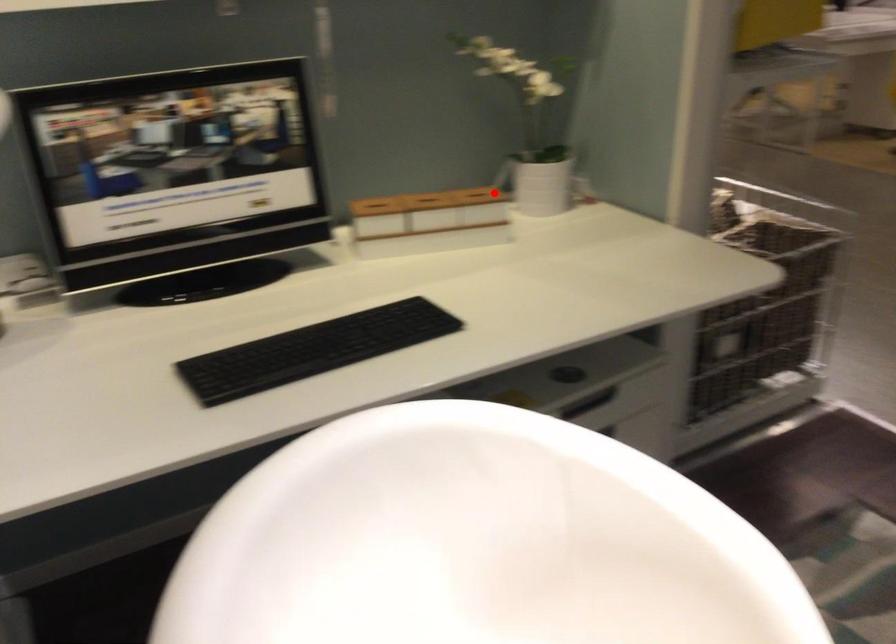
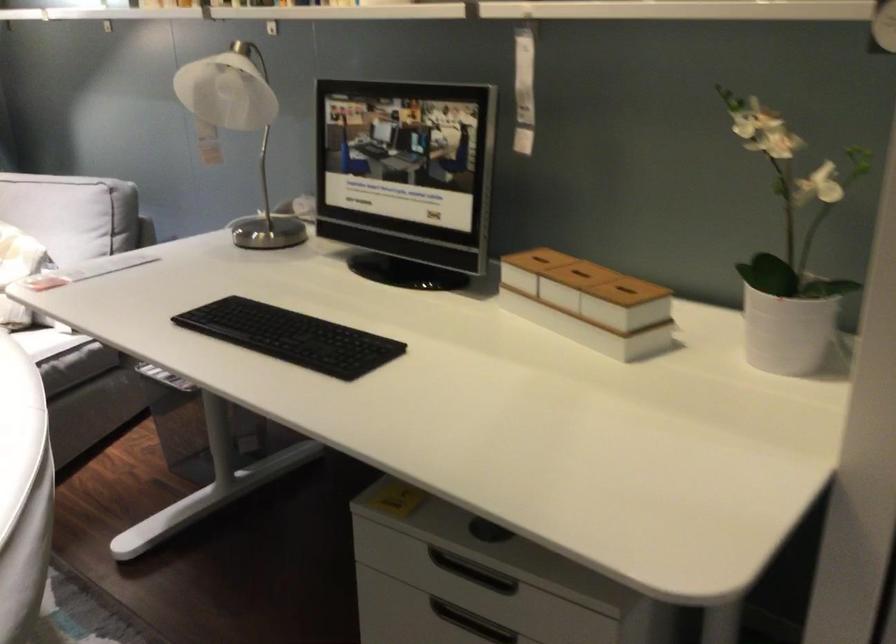
Question: I am providing you with two images of the same scene from different viewpoints. In image1, a red point is highlighted. Considering the same 3D point in image2, which of the following is correct?

Choices:
 (A) It is closer
 (B) It is farther

Answer: (A)